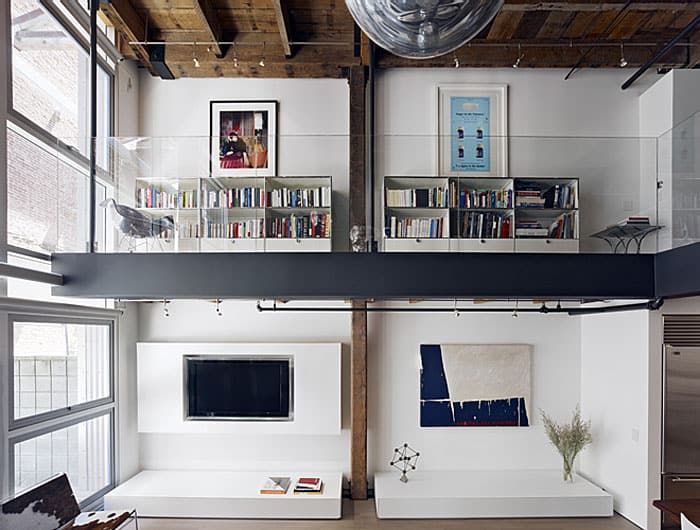
Find the location of a particular element. This screenshot has height=530, width=700. wall is located at coordinates (574, 120).